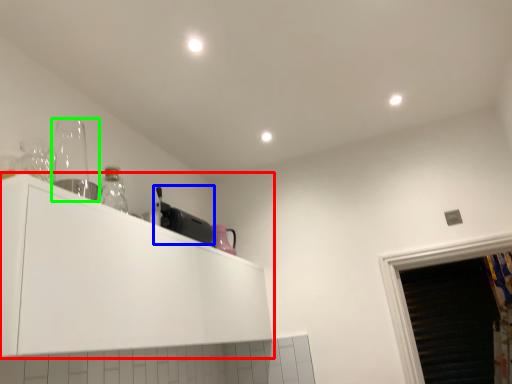
Question: Which object is the farthest from cabinetry (highlighted by a red box)? Choose among these: appliance (highlighted by a blue box) or appliance (highlighted by a green box).

Choices:
 (A) appliance
 (B) appliance

Answer: (B)